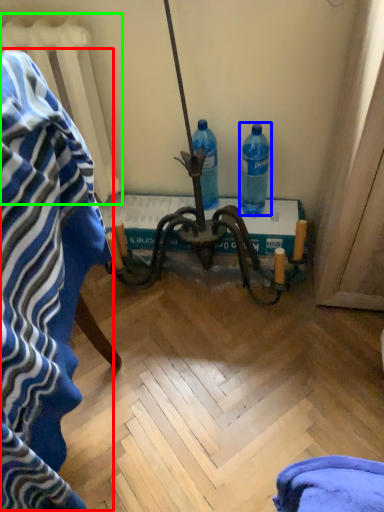
Question: Considering the real-world distances, which object is farthest from bath towel (highlighted by a red box)? bottle (highlighted by a blue box) or radiator (highlighted by a green box)?

Choices:
 (A) bottle
 (B) radiator

Answer: (A)